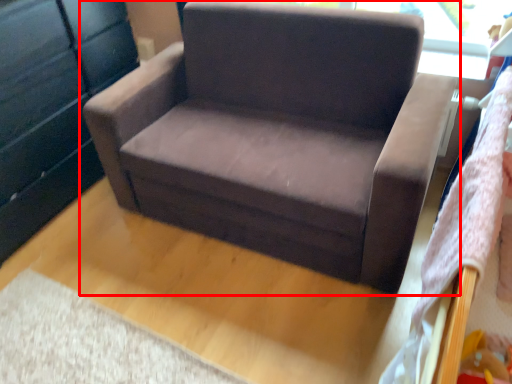
Question: Where is chair (annotated by the red box) located in relation to dresser in the image?

Choices:
 (A) left
 (B) right

Answer: (B)